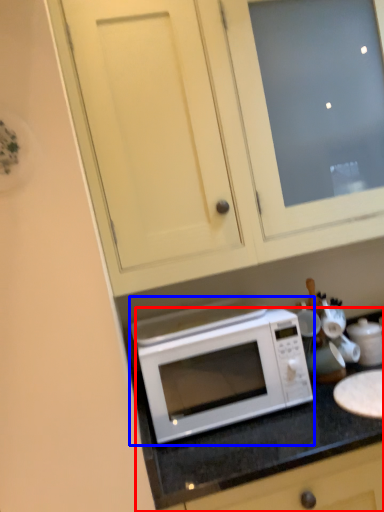
Question: Which point is closer to the camera, counter (highlighted by a red box) or microwave oven (highlighted by a blue box)?

Choices:
 (A) counter
 (B) microwave oven

Answer: (A)